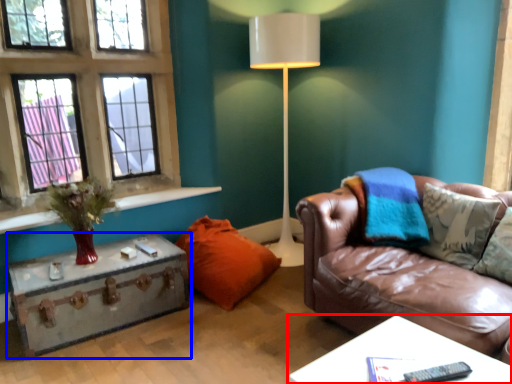
Question: Which object is further to the camera taking this photo, table (highlighted by a red box) or table (highlighted by a blue box)?

Choices:
 (A) table
 (B) table

Answer: (B)